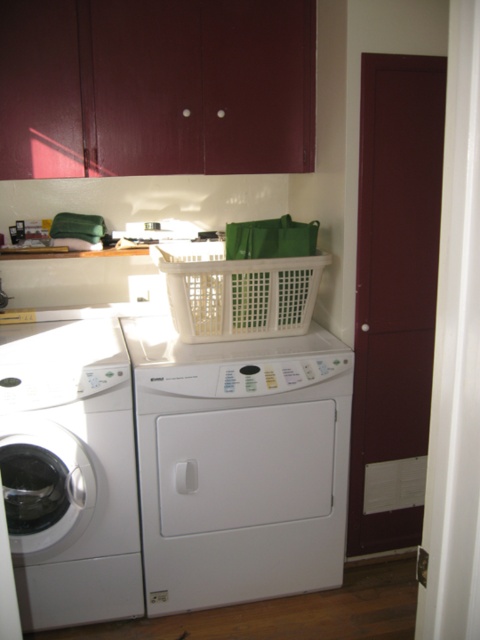
Is point (231, 404) positioned in front of point (37, 397)?

No, (231, 404) is behind (37, 397).

Who is positioned more to the right, white plastic washing machine at center or white glossy washing machine at left?

From the viewer's perspective, white plastic washing machine at center appears more on the right side.

You are a GUI agent. You are given a task and a screenshot of the screen. Output one action in this format:
    pyautogui.click(x=<x>, y=<y>)
    Task: Click on the white plastic washing machine at center
    The image size is (480, 640).
    Given the screenshot: What is the action you would take?
    pyautogui.click(x=239, y=465)

Does white glossy washing machine at left have a lesser height compared to white plastic basket at center?

In fact, white glossy washing machine at left may be taller than white plastic basket at center.

I want to click on white glossy washing machine at left, so click(71, 474).

Does point (144, 458) lie in front of point (279, 260)?

Yes, point (144, 458) is closer to viewer.

Locate an element on the screen. white plastic washing machine at center is located at coordinates (239, 465).

This screenshot has width=480, height=640. I want to click on white plastic washing machine at center, so click(239, 465).

Locate an element on the screen. This screenshot has width=480, height=640. white plastic washing machine at center is located at coordinates (239, 465).